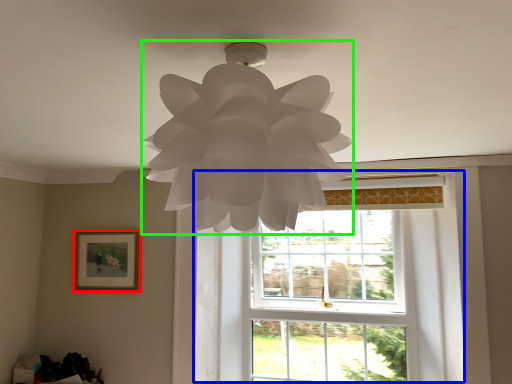
Question: Considering the real-world distances, which object is closest to picture frame (highlighted by a red box)? window (highlighted by a blue box) or lamp (highlighted by a green box).

Choices:
 (A) window
 (B) lamp

Answer: (A)